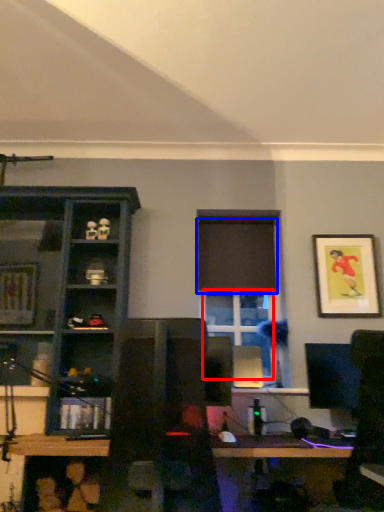
Question: Which object is closer to the camera taking this photo, window (highlighted by a red box) or curtain (highlighted by a blue box)?

Choices:
 (A) window
 (B) curtain

Answer: (A)